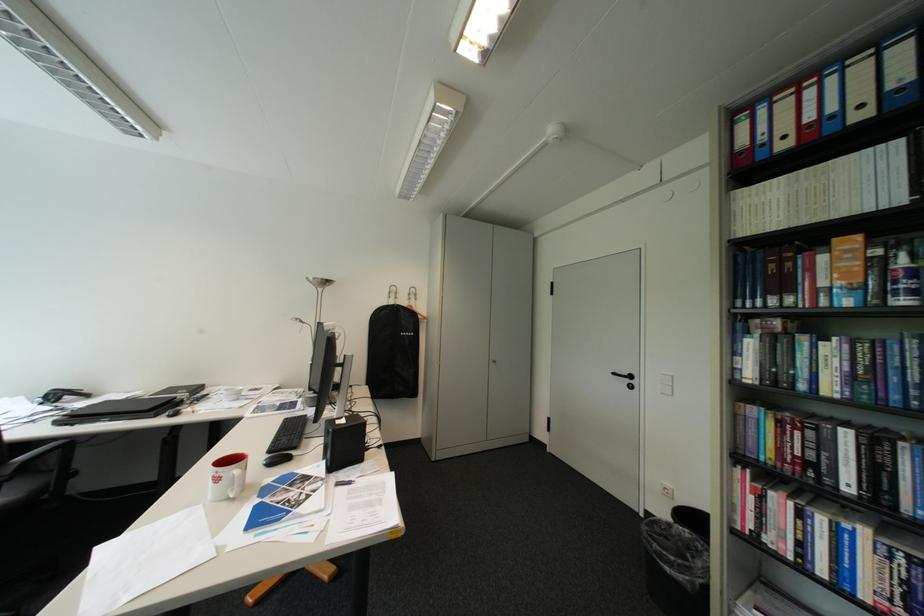
Find the location of a particular element. This screenshot has height=616, width=924. black door handle is located at coordinates (626, 379).